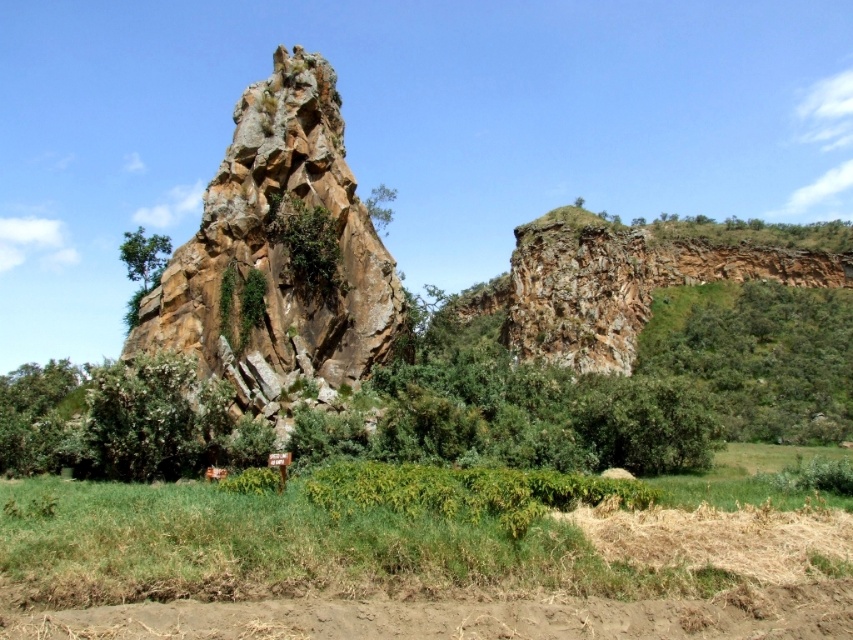
Is green leafy shrub at upper right above green leafy tree at upper center?

Actually, green leafy shrub at upper right is below green leafy tree at upper center.

How much distance is there between green leafy shrub at upper right and green leafy tree at upper center?

85.30 meters

The height and width of the screenshot is (640, 853). Identify the location of green leafy shrub at upper right. (758, 355).

Is green leafy tree at upper left closer to the viewer compared to green leafy tree at upper center?

Yes, it is in front of green leafy tree at upper center.

This screenshot has width=853, height=640. Describe the element at coordinates (144, 256) in the screenshot. I see `green leafy tree at upper left` at that location.

Where is `green leafy tree at upper left`? The width and height of the screenshot is (853, 640). green leafy tree at upper left is located at coordinates (144, 256).

Does point (318, 147) come closer to viewer compared to point (743, 282)?

Yes, point (318, 147) is in front of point (743, 282).

Does brown rough rock at center have a greater height compared to green leafy shrub at upper right?

Correct, brown rough rock at center is much taller as green leafy shrub at upper right.

At what (x,y) coordinates should I click in order to perform the action: click on brown rough rock at center. Please return your answer as a coordinate pair (x, y). Looking at the image, I should click on point(279,256).

Where is `brown rough rock at center`? The height and width of the screenshot is (640, 853). brown rough rock at center is located at coordinates (279, 256).